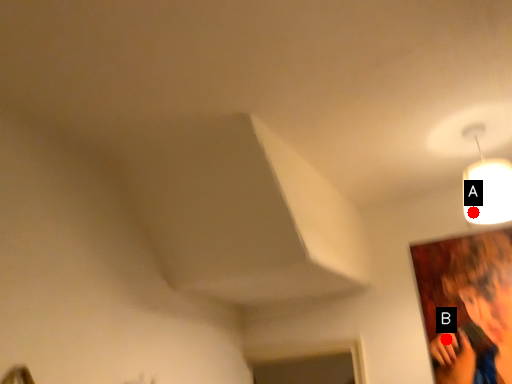
Question: Two points are circled on the image, labeled by A and B beside each circle. Which of the following is the farthest from the observer?

Choices:
 (A) A is further
 (B) B is further

Answer: (B)